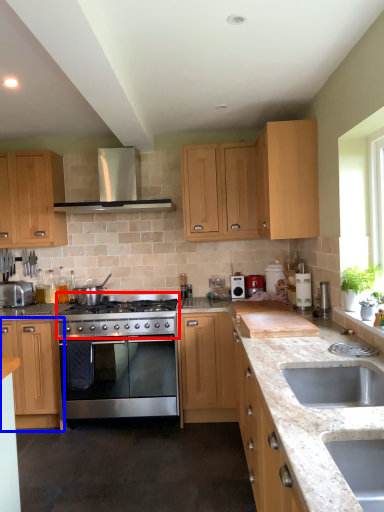
Question: Which point is further to the camera, gas stove (highlighted by a red box) or cabinetry (highlighted by a blue box)?

Choices:
 (A) gas stove
 (B) cabinetry

Answer: (B)